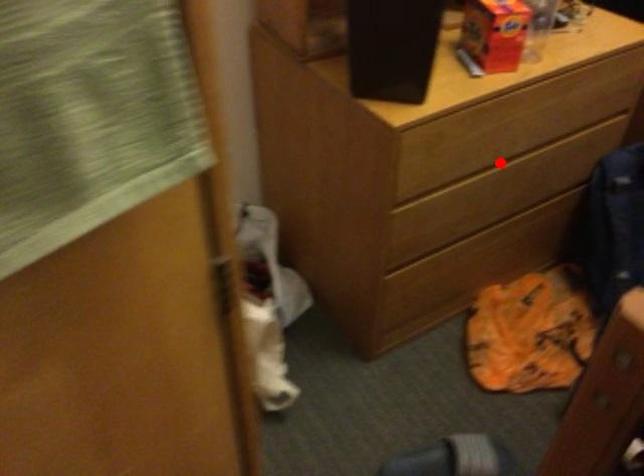
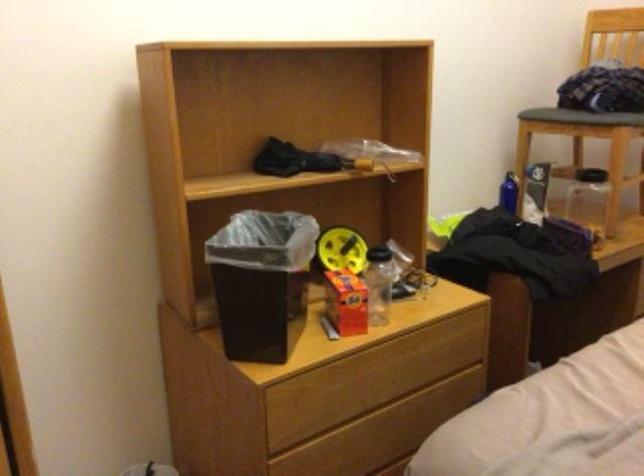
Locate, in the second image, the point that corresponds to the highlighted location in the first image.

(365, 413)